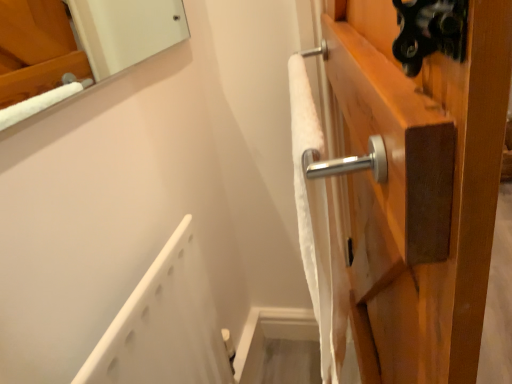
Question: From a real-world perspective, does satin wood door handle at upper right sit lower than white soft towel at upper right?

Choices:
 (A) yes
 (B) no

Answer: (A)

Question: Is the depth of satin wood door handle at upper right less than that of white soft towel at upper right?

Choices:
 (A) yes
 (B) no

Answer: (B)

Question: Is white soft towel at upper right located within satin wood door handle at upper right?

Choices:
 (A) yes
 (B) no

Answer: (B)

Question: Can you confirm if satin wood door handle at upper right is wider than white soft towel at upper right?

Choices:
 (A) no
 (B) yes

Answer: (B)

Question: Is satin wood door handle at upper right taller than white soft towel at upper right?

Choices:
 (A) yes
 (B) no

Answer: (B)

Question: In the image, is white plastic bath at lower left positioned in front of or behind satin wood door handle at upper right?

Choices:
 (A) behind
 (B) front

Answer: (B)

Question: In terms of size, does white plastic bath at lower left appear bigger or smaller than satin wood door handle at upper right?

Choices:
 (A) big
 (B) small

Answer: (B)

Question: From a real-world perspective, is white plastic bath at lower left physically located above or below satin wood door handle at upper right?

Choices:
 (A) above
 (B) below

Answer: (A)

Question: Considering the positions of white plastic bath at lower left and satin wood door handle at upper right in the image, is white plastic bath at lower left wider or thinner than satin wood door handle at upper right?

Choices:
 (A) wide
 (B) thin

Answer: (B)

Question: Considering the relative positions of white soft towel at upper right and white plastic bath at lower left in the image provided, is white soft towel at upper right to the left or to the right of white plastic bath at lower left?

Choices:
 (A) left
 (B) right

Answer: (B)

Question: From the image's perspective, is white soft towel at upper right above or below white plastic bath at lower left?

Choices:
 (A) below
 (B) above

Answer: (B)

Question: From a real-world perspective, is white soft towel at upper right positioned above or below white plastic bath at lower left?

Choices:
 (A) above
 (B) below

Answer: (A)

Question: Is white soft towel at upper right situated inside white plastic bath at lower left or outside?

Choices:
 (A) outside
 (B) inside

Answer: (A)

Question: Considering the relative positions of satin wood door handle at upper right and white soft towel at upper right in the image provided, is satin wood door handle at upper right to the left or to the right of white soft towel at upper right?

Choices:
 (A) right
 (B) left

Answer: (A)

Question: Would you say satin wood door handle at upper right is inside or outside white soft towel at upper right?

Choices:
 (A) outside
 (B) inside

Answer: (A)